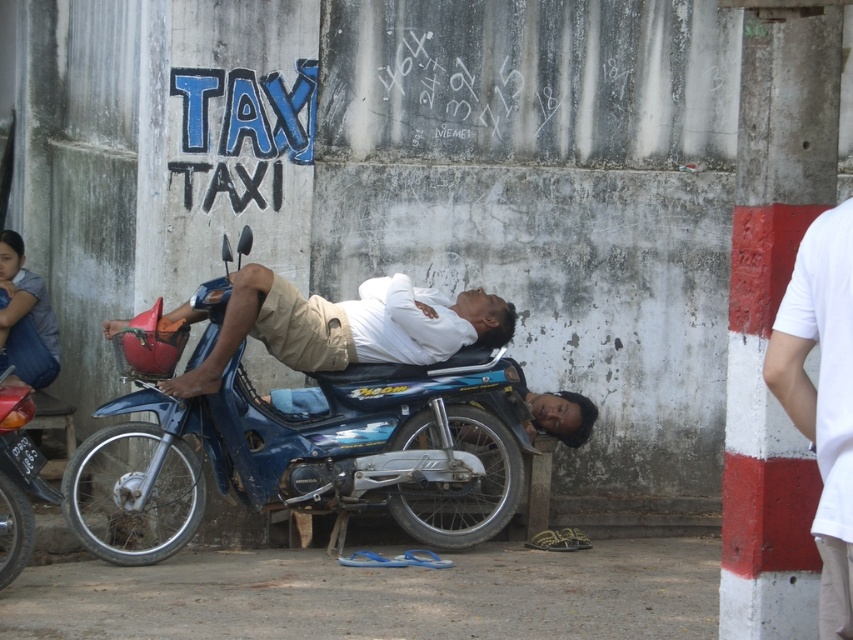
Which is behind, point (376, 280) or point (815, 250)?

The point (376, 280) is more distant.

Can you confirm if white matte shirt at center is positioned to the right of white cotton shirt at right?

In fact, white matte shirt at center is to the left of white cotton shirt at right.

Describe the element at coordinates (345, 326) in the screenshot. I see `white matte shirt at center` at that location.

Find the location of a particular element. The height and width of the screenshot is (640, 853). white matte shirt at center is located at coordinates (345, 326).

Based on the photo, is blue metallic motorcycle at center thinner than white cotton shirt at right?

No, blue metallic motorcycle at center is not thinner than white cotton shirt at right.

Find the location of a particular element. This screenshot has height=640, width=853. blue metallic motorcycle at center is located at coordinates (288, 452).

This screenshot has height=640, width=853. I want to click on blue metallic motorcycle at center, so click(288, 452).

Looking at this image, can you confirm if blue metallic motorcycle at center is taller than white matte shirt at center?

Yes.

Does point (427, 436) come in front of point (303, 356)?

No, it is behind (303, 356).

Identify the location of blue metallic motorcycle at center. Image resolution: width=853 pixels, height=640 pixels. (288, 452).